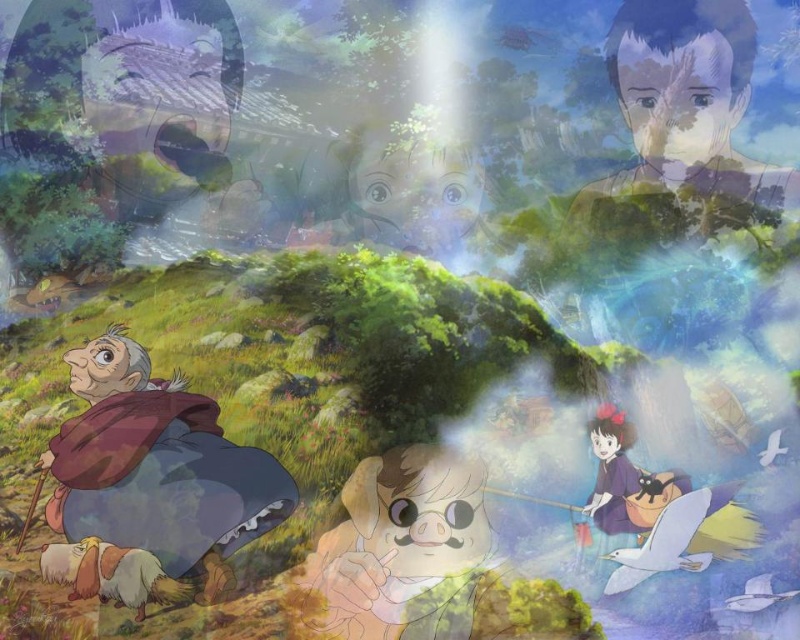
Question: Which object is farther from the camera taking this photo?

Choices:
 (A) brown woolen coat at lower left
 (B) smooth skin face at center
 (C) smooth beige pig at center

Answer: (B)

Question: Is brown woolen coat at lower left closer to camera compared to smooth beige pig at center?

Choices:
 (A) yes
 (B) no

Answer: (A)

Question: Which point appears closest to the camera in this image?

Choices:
 (A) (736, 97)
 (B) (364, 129)
 (C) (402, 557)

Answer: (A)

Question: Among these points, which one is nearest to the camera?

Choices:
 (A) (476, 202)
 (B) (348, 508)

Answer: (B)

Question: Does smooth skin face at upper right appear over matte purple kimono at center?

Choices:
 (A) no
 (B) yes

Answer: (B)

Question: Can you confirm if brown woolen coat at lower left is thinner than smooth skin face at center?

Choices:
 (A) yes
 (B) no

Answer: (B)